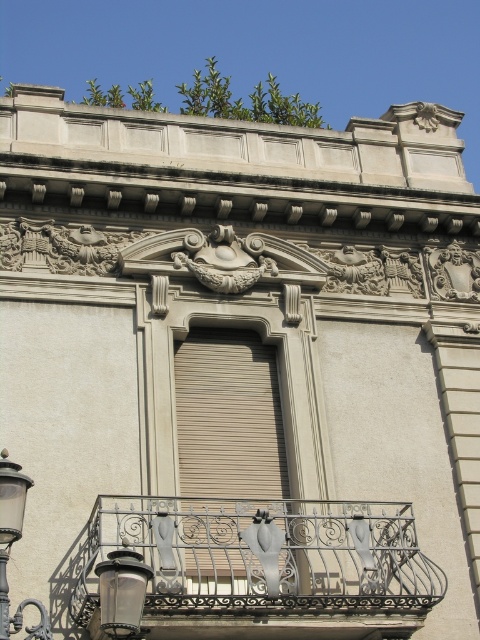
Question: Can you confirm if wrought iron balcony at center is bigger than metallic streetlamp at lower left?

Choices:
 (A) yes
 (B) no

Answer: (A)

Question: Is matte black lantern at lower left further to the viewer compared to metallic streetlamp at lower left?

Choices:
 (A) no
 (B) yes

Answer: (A)

Question: Which point is farther to the camera?

Choices:
 (A) (223, 476)
 (B) (224, 538)
 (C) (14, 497)
 (D) (108, 577)

Answer: (A)

Question: Can you confirm if matte black lantern at lower left is smaller than metallic streetlamp at lower left?

Choices:
 (A) no
 (B) yes

Answer: (B)

Question: Which is farther from the metallic streetlamp at lower left?

Choices:
 (A) matte black lantern at lower left
 (B) wrought iron balcony at center
 (C) beige matte shutter at center

Answer: (C)

Question: Estimate the real-world distances between objects in this image. Which object is farther from the matte black lantern at lower left?

Choices:
 (A) beige matte shutter at center
 (B) wrought iron balcony at center

Answer: (A)